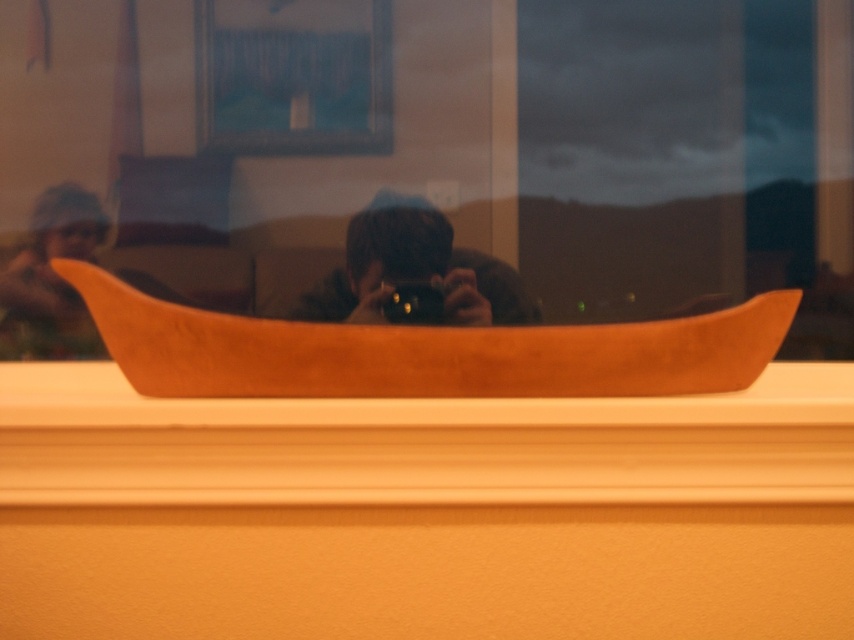
You are trying to hang a picture frame that is 1.2 meters wide on the wall behind the transparent glass window at upper center and the matte brown wooden boat at left. Which object should you avoid placing the frame next to if you want the frame to fit without overlapping?

You should avoid placing the frame next to the transparent glass window at upper center because its width is greater than the matte brown wooden boat at left, so the frame may not fit next to the wider window.

You are organizing a photography exhibition and need to display the matte black camera at center and the matte brown wooden boat at left. If the display case can only accommodate items up to the size of the boat, will the camera fit?

The matte black camera at center is larger in width than the matte brown wooden boat at left. Since the display case can only fit items up to the boat size, the camera will not fit.

You are setting up a photo shoot inside the room. You have a matte black camera at center and a transparent glass window at upper center. Which object should you use to frame your composition if you want to include more of the outdoor scene?

The transparent glass window at upper center is larger in size than the matte black camera at center, so using the window would allow you to frame more of the outdoor scene in your composition.